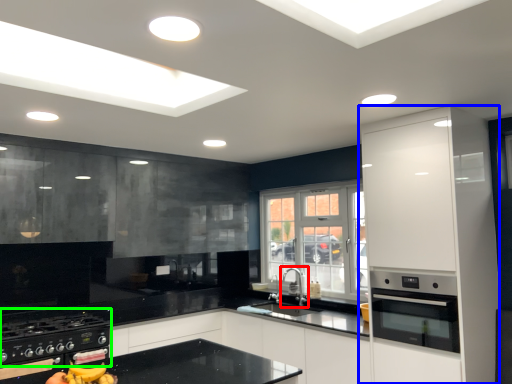
Question: Which object is the farthest from tap (highlighted by a red box)? Choose among these: cabinetry (highlighted by a blue box) or gas stove (highlighted by a green box).

Choices:
 (A) cabinetry
 (B) gas stove

Answer: (B)